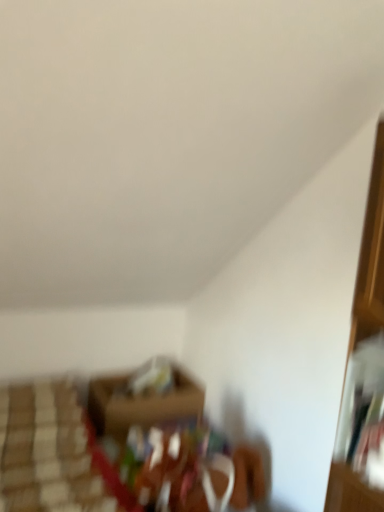
The image size is (384, 512). What do you see at coordinates (141, 404) in the screenshot? I see `brown cardboard box at center` at bounding box center [141, 404].

Locate an element on the screen. brown cardboard box at center is located at coordinates (141, 404).

Where is `brown cardboard box at center`? The image size is (384, 512). brown cardboard box at center is located at coordinates (141, 404).